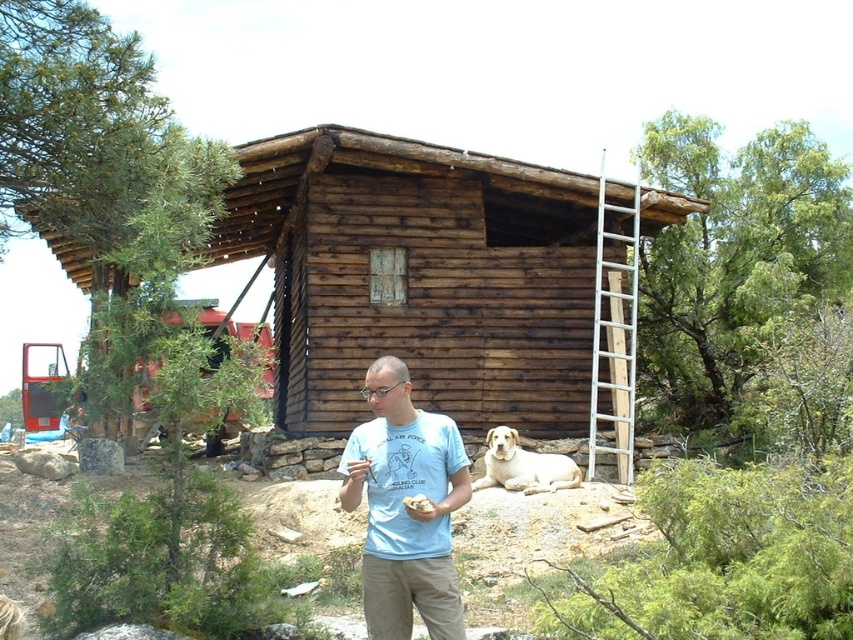
Who is lower down, brown wooden cabin at center or light blue t-shirt at center?

Positioned lower is light blue t-shirt at center.

Who is more forward, (412, 337) or (393, 577)?

Point (393, 577) is in front.

Find the location of a particular element. The image size is (853, 640). brown wooden cabin at center is located at coordinates (419, 275).

Which is in front, point (474, 422) or point (492, 452)?

Positioned in front is point (492, 452).

The width and height of the screenshot is (853, 640). I want to click on brown wooden cabin at center, so click(419, 275).

Is silver metallic ladder at right to the right of light yellow fur at lower center from the viewer's perspective?

Yes, silver metallic ladder at right is to the right of light yellow fur at lower center.

Who is higher up, silver metallic ladder at right or light yellow fur at lower center?

silver metallic ladder at right is above.

Who is more forward, (631, 257) or (488, 461)?

Point (488, 461) is more forward.

The width and height of the screenshot is (853, 640). Identify the location of silver metallic ladder at right. (614, 333).